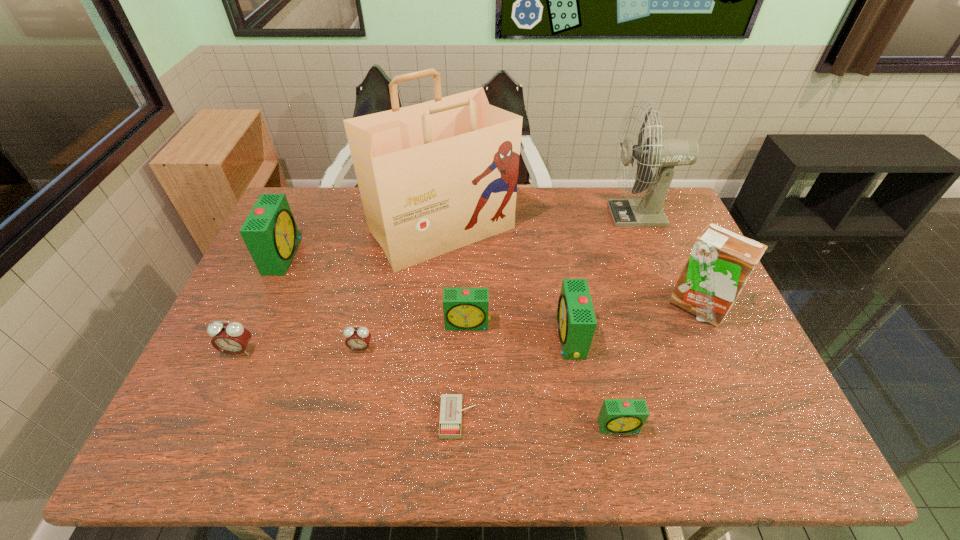
Find the location of `grocery bag`. grocery bag is located at coordinates (433, 177).

What are the coordinates of `brown grocery bag` in the screenshot? It's located at (433, 177).

Locate an element on the screen. the second tallest object is located at coordinates (665, 153).

Image resolution: width=960 pixels, height=540 pixels. I want to click on fan, so click(x=665, y=153).

I want to click on the eighth shortest object, so click(x=721, y=261).

Where is `the biggest green alarm clock`? the biggest green alarm clock is located at coordinates (270, 233).

I want to click on the farthest green alarm clock, so click(x=270, y=233).

Find the location of a particular element. Image resolution: width=960 pixels, height=540 pixels. the second tallest alarm clock is located at coordinates (576, 320).

Locate an element on the screen. This screenshot has height=540, width=960. the sixth shortest object is located at coordinates (576, 320).

At what (x,y) coordinates should I click in order to perform the action: click on the left pink alarm clock. Please return your answer as a coordinate pair (x, y). The image size is (960, 540). Looking at the image, I should click on (232, 338).